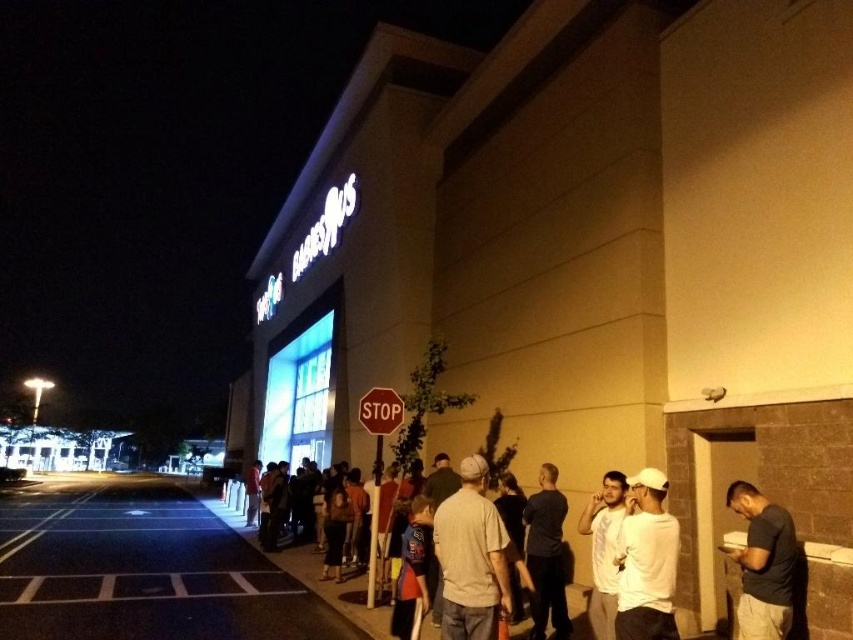
Question: Does white cotton shirt at center appear on the right side of red matte stop sign at center?

Choices:
 (A) yes
 (B) no

Answer: (A)

Question: Which point is closer to the camera taking this photo?

Choices:
 (A) (598, 572)
 (B) (230, 592)

Answer: (A)

Question: Among these points, which one is farthest from the camera?

Choices:
 (A) (67, 576)
 (B) (532, 609)
 (C) (730, 506)

Answer: (A)

Question: Which object is farther from the camera taking this photo?

Choices:
 (A) beige cotton t-shirt at center
 (B) red matte stop sign at center

Answer: (B)

Question: Is dark blue t-shirt at center wider than red matte stop sign at center?

Choices:
 (A) yes
 (B) no

Answer: (B)

Question: Is the position of beige cotton t-shirt at center less distant than that of white painted lines at lower center?

Choices:
 (A) yes
 (B) no

Answer: (A)